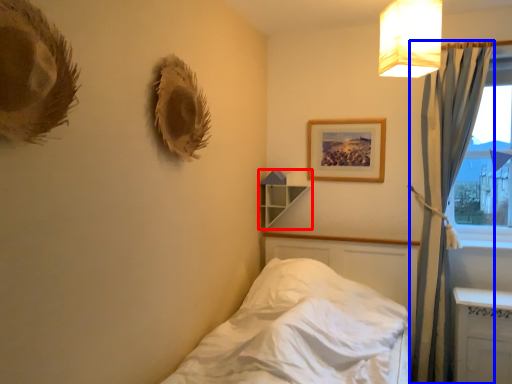
Question: Which object appears closest to the camera in this image, shelf (highlighted by a red box) or curtain (highlighted by a blue box)?

Choices:
 (A) shelf
 (B) curtain

Answer: (B)